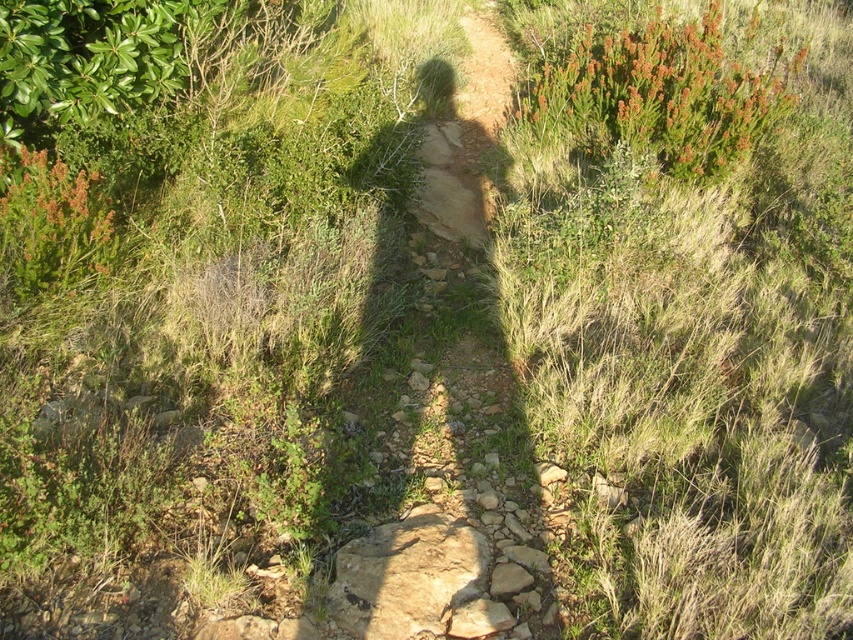
Locate an element on the screen. dirt path at center is located at coordinates (447, 422).

Who is positioned more to the right, dirt path at center or green leafy bush at upper right?

Positioned to the right is green leafy bush at upper right.

Describe the element at coordinates (447, 422) in the screenshot. The image size is (853, 640). I see `dirt path at center` at that location.

Where is `dirt path at center`? The height and width of the screenshot is (640, 853). dirt path at center is located at coordinates (447, 422).